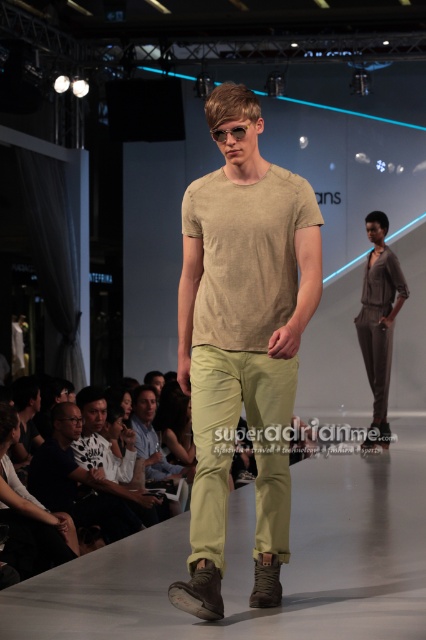
Can you confirm if matte black shirt at center is positioned below clear plastic goggles at center?

Yes, matte black shirt at center is below clear plastic goggles at center.

Between point (45, 484) and point (241, 136), which one is positioned behind?

The point (45, 484) is more distant.

Which is in front, point (36, 465) or point (233, 138)?

Positioned in front is point (233, 138).

Locate an element on the screen. The image size is (426, 640). matte black shirt at center is located at coordinates (78, 481).

Can you confirm if beige cotton t-shirt at center is positioned below matte black t-shirt at center?

No, beige cotton t-shirt at center is not below matte black t-shirt at center.

The width and height of the screenshot is (426, 640). Describe the element at coordinates (242, 340) in the screenshot. I see `beige cotton t-shirt at center` at that location.

The width and height of the screenshot is (426, 640). I want to click on beige cotton t-shirt at center, so click(x=242, y=340).

This screenshot has width=426, height=640. What do you see at coordinates (78, 481) in the screenshot? I see `matte black shirt at center` at bounding box center [78, 481].

Measure the distance between matte black shirt at center and matte gray jumpsuit at center.

matte black shirt at center is 4.66 meters away from matte gray jumpsuit at center.

Is point (54, 413) positioned behind point (367, 436)?

No, (54, 413) is in front of (367, 436).

Locate an element on the screen. matte black shirt at center is located at coordinates (78, 481).